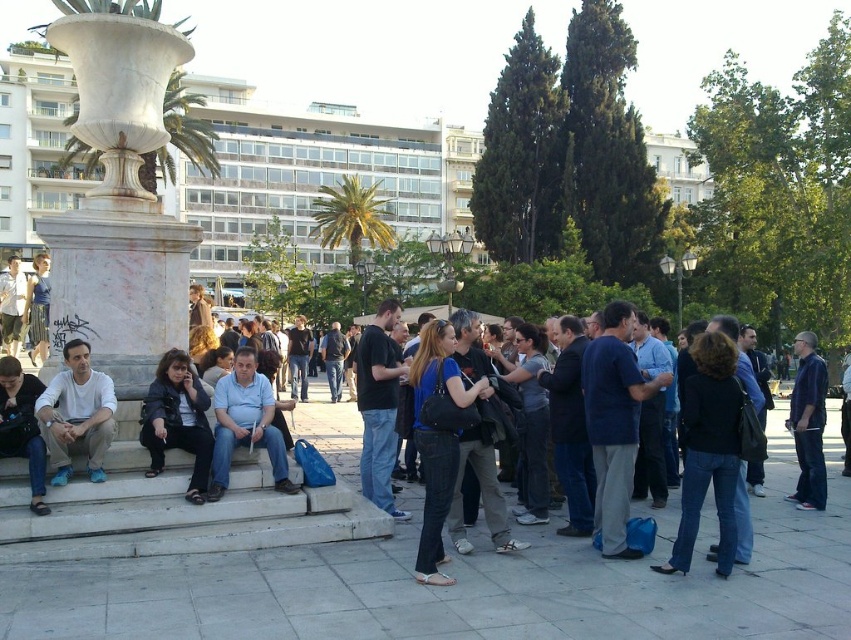
Does dark blue jeans at center have a greater height compared to blue denim jeans at center?

No.

Where is `dark blue jeans at center`? The height and width of the screenshot is (640, 851). dark blue jeans at center is located at coordinates (709, 451).

The image size is (851, 640). I want to click on blue denim jeans at center, so [x=438, y=435].

Between point (415, 355) and point (530, 330), which one is positioned behind?

Positioned behind is point (530, 330).

The image size is (851, 640). I want to click on blue denim jeans at center, so click(x=438, y=435).

Does white marble vase at left have a greater width compared to blue denim jeans at center?

Yes.

Is white marble vase at left smaller than blue denim jeans at center?

Incorrect, white marble vase at left is not smaller in size than blue denim jeans at center.

Does point (76, 22) come in front of point (429, 378)?

No, (76, 22) is further to viewer.

The image size is (851, 640). I want to click on white marble vase at left, so click(x=118, y=193).